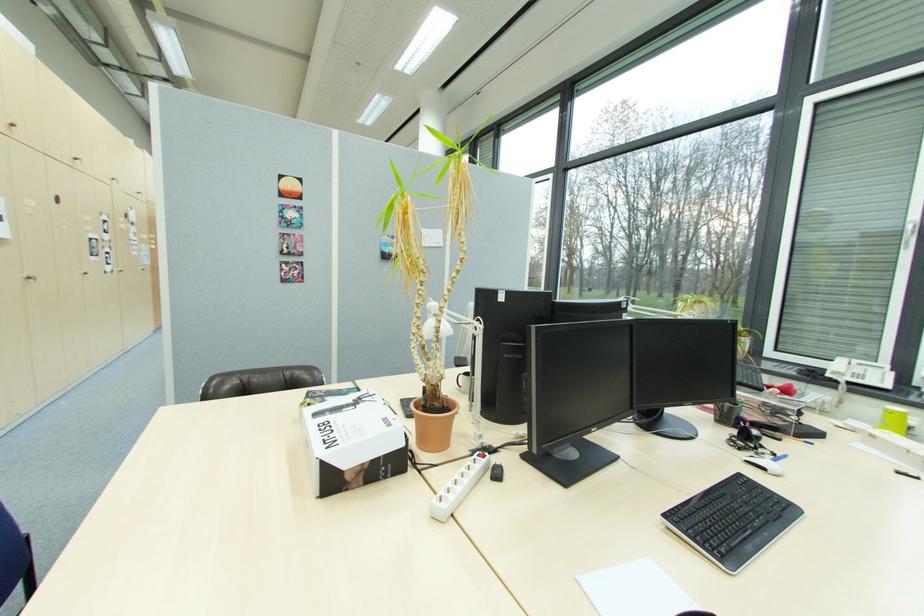
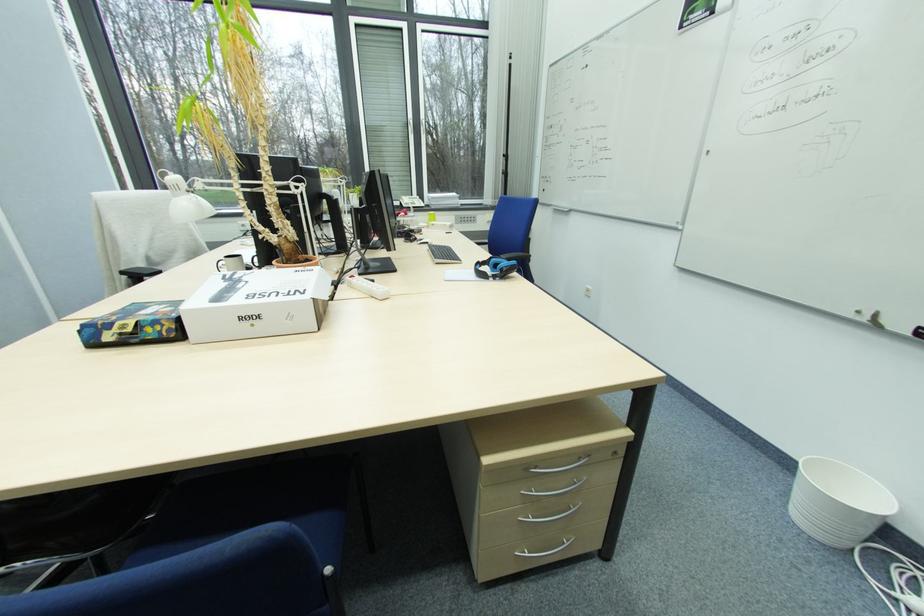
Find the pixel in the second image that matches pixel 440 403 in the first image.

(302, 257)